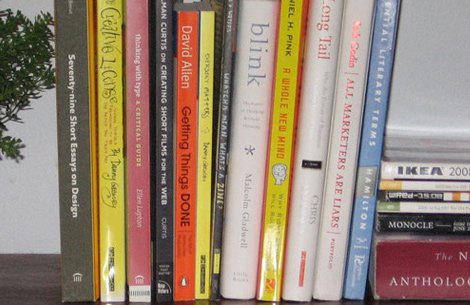
Locate an element on the screen. This screenshot has height=305, width=470. wall is located at coordinates (423, 98).